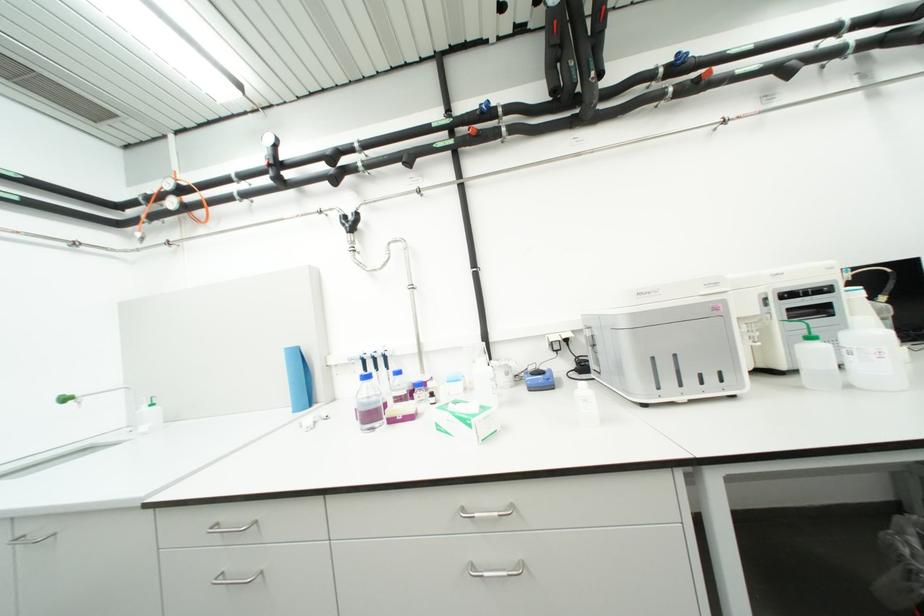
Locate an element on the screen. The image size is (924, 616). green faucet handle is located at coordinates (805, 330).